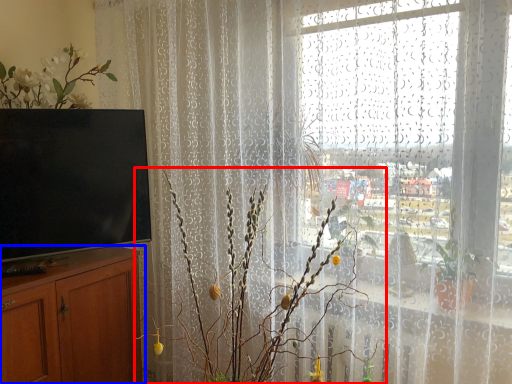
Question: Which object is further to the camera taking this photo, floral arrangement (highlighted by a red box) or cabinetry (highlighted by a blue box)?

Choices:
 (A) floral arrangement
 (B) cabinetry

Answer: (B)